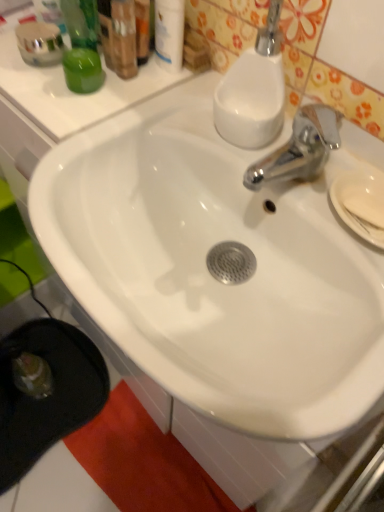
Where is `empty space that is in between white matte soap at right and green matte jar at upper left`? The width and height of the screenshot is (384, 512). empty space that is in between white matte soap at right and green matte jar at upper left is located at coordinates (207, 140).